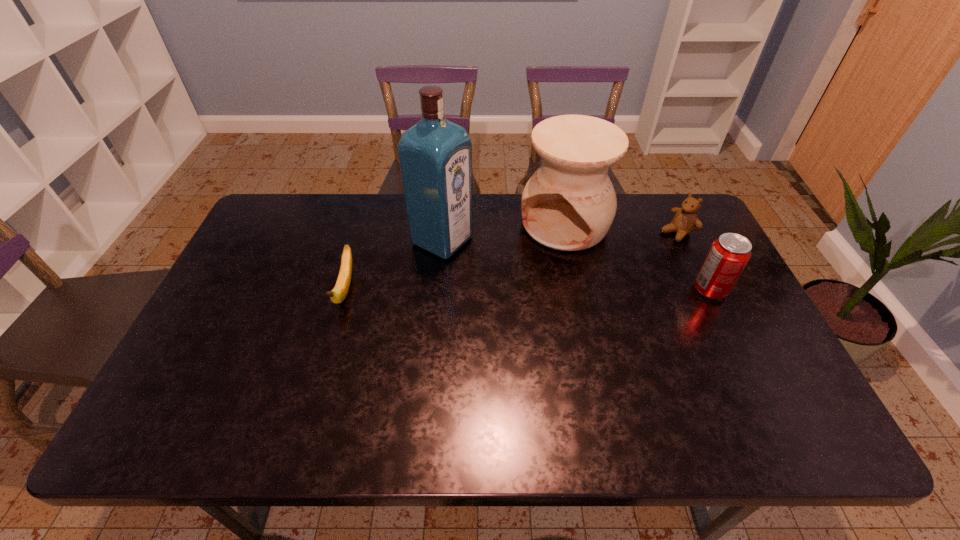
Find the location of a particular element. liquor that is positioned at the far edge is located at coordinates (435, 155).

Identify the location of teddy bear that is at the far edge. (685, 220).

Locate an element on the screen. This screenshot has height=540, width=960. soda that is at the right edge is located at coordinates (729, 254).

The image size is (960, 540). What are the coordinates of `teddy bear located at the right edge` in the screenshot? It's located at (685, 220).

Find the location of a particular element. The width and height of the screenshot is (960, 540). object that is at the far right corner is located at coordinates (685, 220).

Locate an element on the screen. vacant space at the far edge of the desktop is located at coordinates (357, 195).

At what (x,y) coordinates should I click in order to perform the action: click on free spot at the near edge of the desktop. Please return your answer as a coordinate pair (x, y). Image resolution: width=960 pixels, height=540 pixels. Looking at the image, I should click on (494, 382).

In the image, there is a desktop. Identify the location of free space at the right edge. This screenshot has height=540, width=960. (697, 310).

Where is `free space at the far left corner of the desktop`? This screenshot has width=960, height=540. free space at the far left corner of the desktop is located at coordinates (283, 232).

Locate an element on the screen. The image size is (960, 540). free space at the near left corner of the desktop is located at coordinates (167, 399).